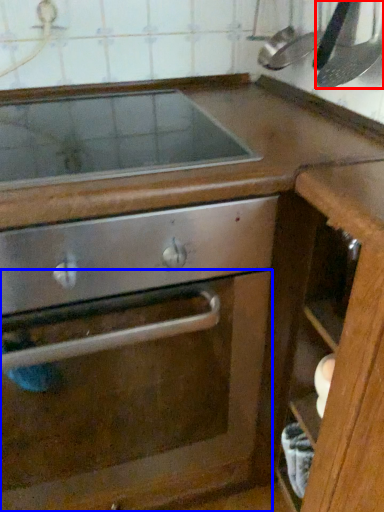
Question: Which point is further to the camera, kitchen appliance (highlighted by a red box) or glass door (highlighted by a blue box)?

Choices:
 (A) kitchen appliance
 (B) glass door

Answer: (A)